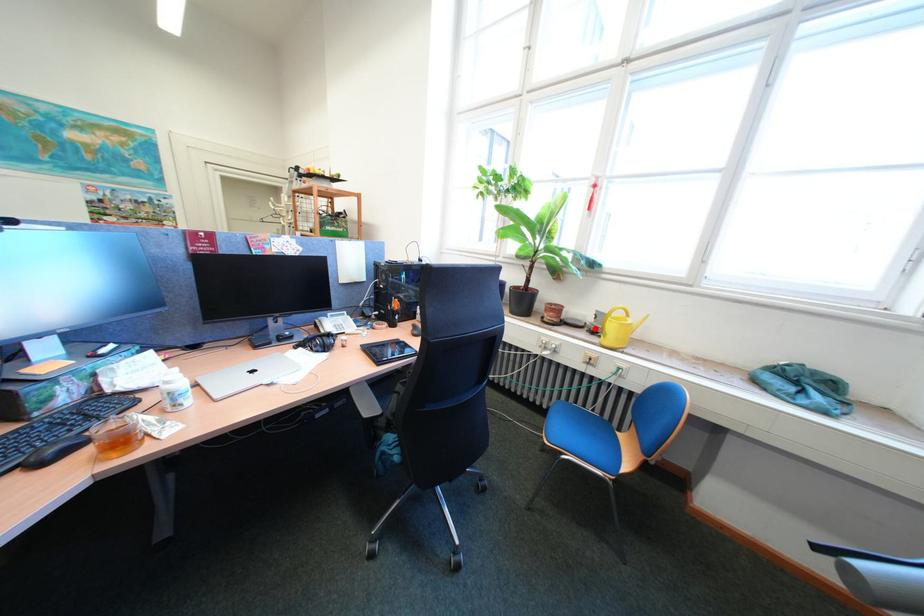
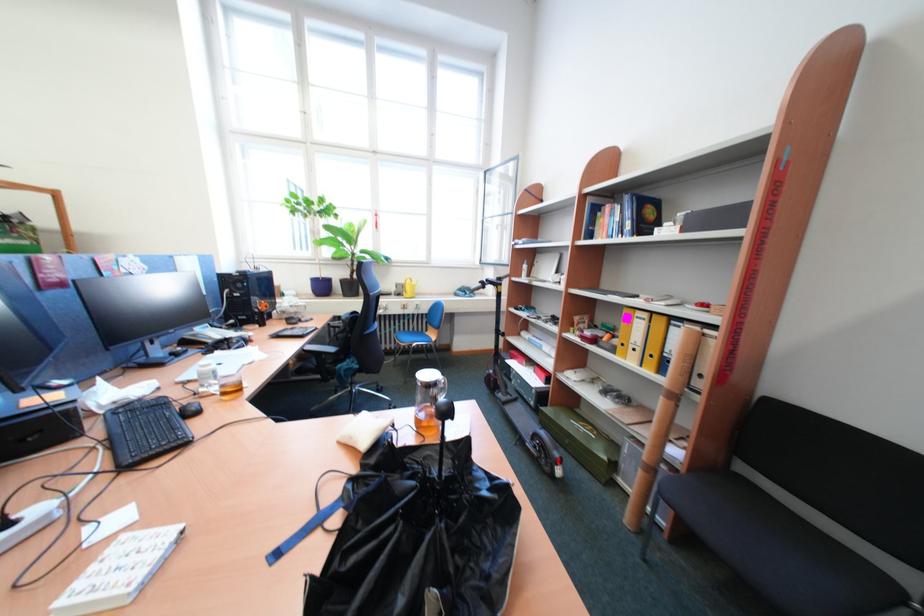
Where in the second image is the point corresponding to the highlighted location from the first image?

(403, 296)